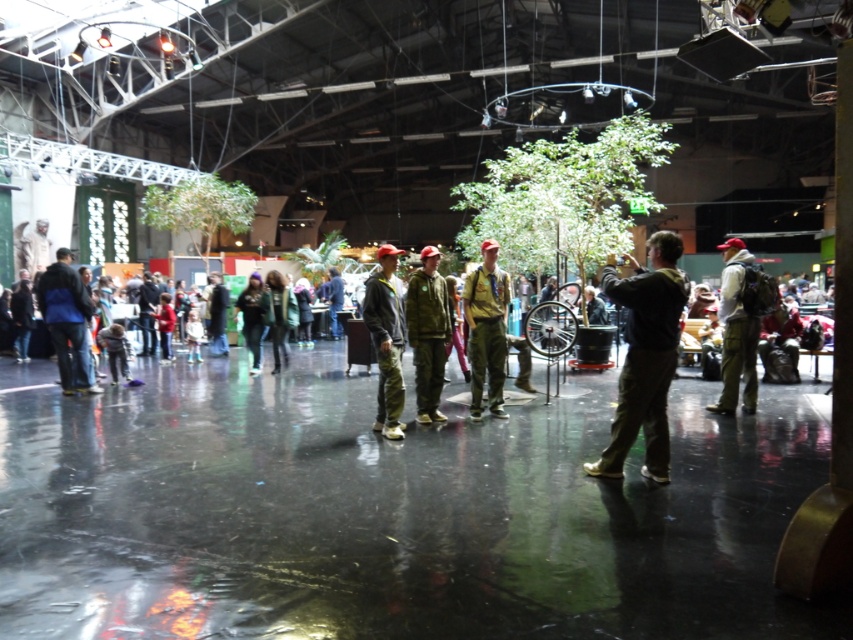
Is camo pants at center shorter than blue jacket at left?

Indeed, camo pants at center has a lesser height compared to blue jacket at left.

Is camo pants at center closer to camera compared to blue jacket at left?

Yes, camo pants at center is in front of blue jacket at left.

The height and width of the screenshot is (640, 853). What do you see at coordinates (386, 340) in the screenshot?
I see `camo pants at center` at bounding box center [386, 340].

At what (x,y) coordinates should I click in order to perform the action: click on camo pants at center. Please return your answer as a coordinate pair (x, y). This screenshot has width=853, height=640. Looking at the image, I should click on (386, 340).

Does point (722, 365) come in front of point (53, 276)?

Yes, point (722, 365) is closer to viewer.

Who is lower down, matte khaki pants at right or blue jacket at left?

blue jacket at left is below.

The image size is (853, 640). Identify the location of matte khaki pants at right. (741, 323).

Identify the location of matte khaki pants at right. This screenshot has width=853, height=640. [741, 323].

Does camouflage fabric jacket at center appear over blue jacket at left?

Yes.

Locate an element on the screen. camouflage fabric jacket at center is located at coordinates (428, 333).